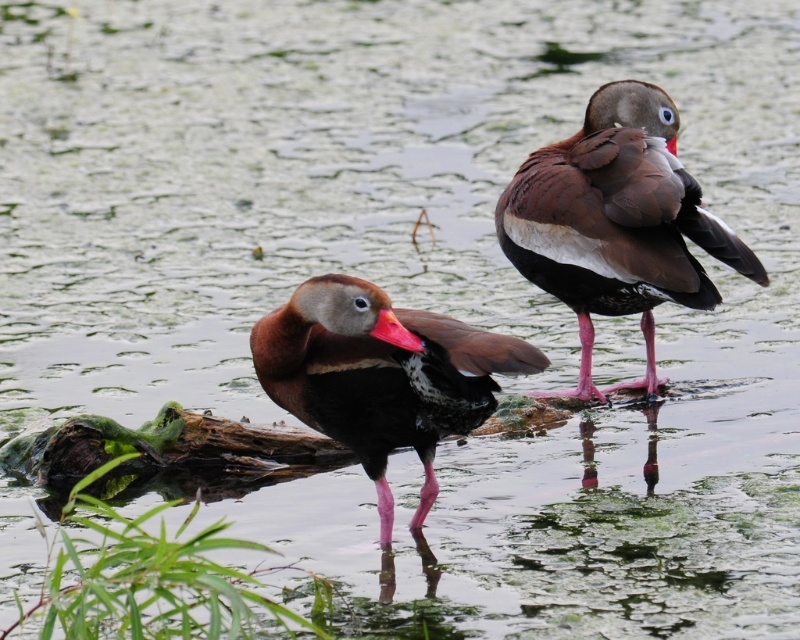
Looking at this image, you are a wildlife photographer trying to capture a clear photo of the brown glossy duck at center and the rubberized red beak at center. Which one should you focus on to ensure it appears sharp and in focus?

You should focus on the brown glossy duck at center because it is larger in size than the rubberized red beak at center, making it easier to capture a sharp image.

You are a photographer trying to capture a closeup of the brown glossy duck at upper right. You are currently positioned at the point with coordinates point [616,221]. Is this the correct location to take the photo?

Yes, because point [616,221] corresponds to the brown glossy duck at upper right.

You are a wildlife photographer aiming to capture a closeup shot of the brown glossy duck at upper right and the brown glossy duck at center. Given that your camera can only focus on one duck at a time, which duck should you focus on to ensure the subject fills the frame adequately?

The brown glossy duck at upper right is bigger than the brown glossy duck at center, so focusing on the brown glossy duck at upper right will ensure the subject fills the frame adequately.